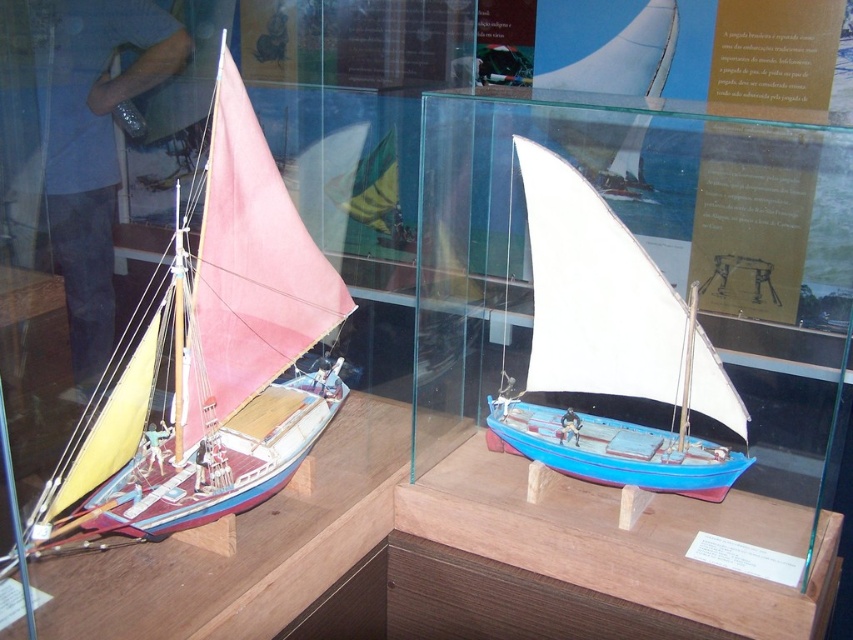
Question: Does matte pink sail at left have a smaller size compared to white matte sailboat at center?

Choices:
 (A) yes
 (B) no

Answer: (B)

Question: Does matte pink sail at left appear under white matte sailboat at center?

Choices:
 (A) no
 (B) yes

Answer: (A)

Question: Among these objects, which one is nearest to the camera?

Choices:
 (A) white matte sailboat at center
 (B) matte pink sail at left

Answer: (B)

Question: Is matte pink sail at left above white matte sailboat at center?

Choices:
 (A) yes
 (B) no

Answer: (A)